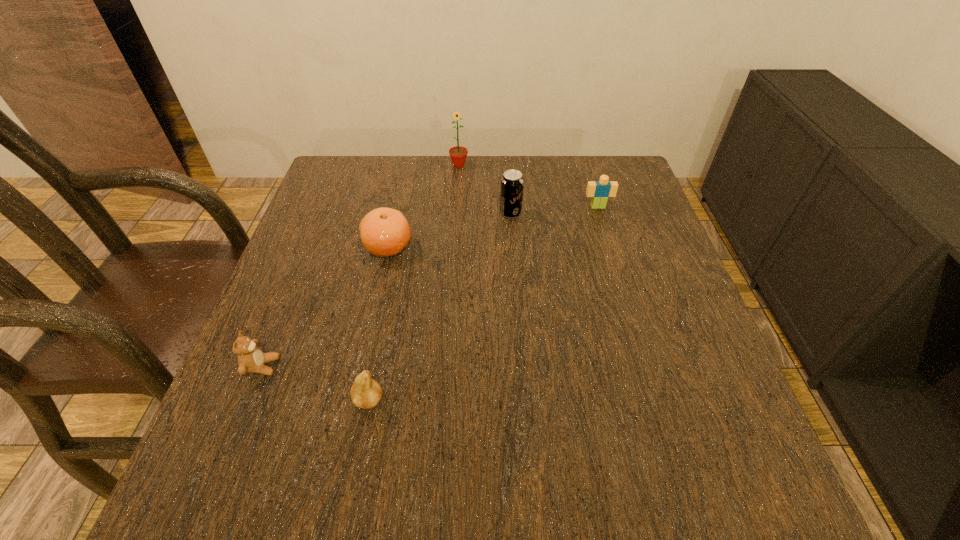
Identify the location of object that is positioned at the far right corner. (600, 190).

At what (x,y) coordinates should I click in order to perform the action: click on vacant space at the far edge. Please return your answer as a coordinate pair (x, y). Looking at the image, I should click on (469, 205).

Find the location of a particular element. This screenshot has width=960, height=540. vacant point at the left edge is located at coordinates (295, 444).

Image resolution: width=960 pixels, height=540 pixels. Find the location of `free space at the right edge of the desktop`. free space at the right edge of the desktop is located at coordinates click(x=621, y=249).

This screenshot has width=960, height=540. In the image, there is a desktop. What are the coordinates of `vacant space at the far left corner` in the screenshot? It's located at (374, 171).

Locate an element on the screen. The height and width of the screenshot is (540, 960). blank area at the near left corner is located at coordinates (283, 458).

Identify the location of vacant space at the far right corner of the desktop. (635, 192).

I want to click on vacant space at the near right corner of the desktop, so click(x=749, y=462).

This screenshot has height=540, width=960. In order to click on vacant space that is in between the tallest object and the second tallest object in this screenshot , I will do `click(485, 190)`.

Locate an element on the screen. This screenshot has height=540, width=960. vacant space that is in between the pear and the clementine is located at coordinates pos(378,323).